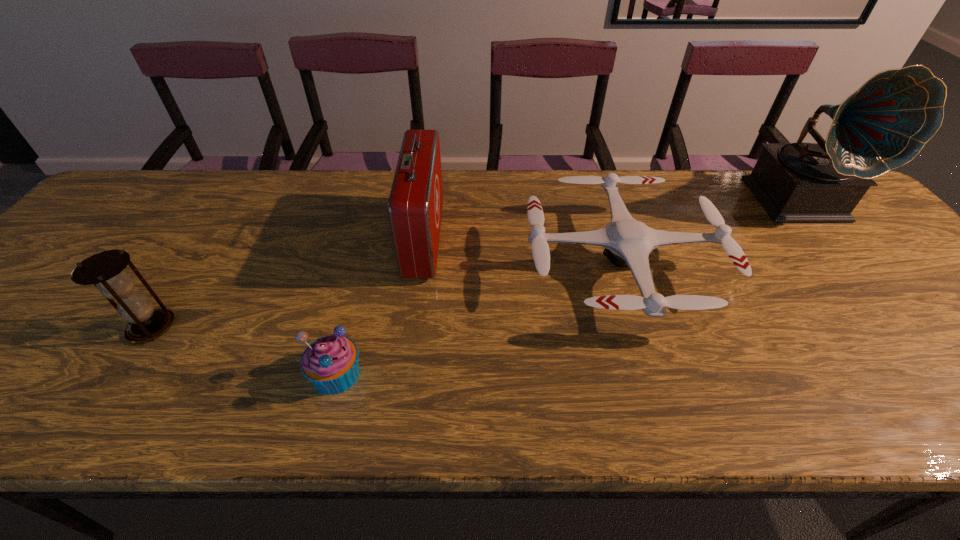
The height and width of the screenshot is (540, 960). I want to click on object that is at the right edge, so click(883, 125).

This screenshot has width=960, height=540. I want to click on object that is at the far right corner, so click(883, 125).

The image size is (960, 540). I want to click on free region at the far edge of the desktop, so pos(299,201).

Locate an element on the screen. vacant space at the near edge of the desktop is located at coordinates (646, 404).

You are a GUI agent. You are given a task and a screenshot of the screen. Output one action in this format:
    pyautogui.click(x=<x>, y=<y>)
    Task: Click on the blank space at the far left corner of the desktop
    The image size is (960, 540).
    Given the screenshot: What is the action you would take?
    pyautogui.click(x=156, y=196)

Where is `blank region between the fourth object from left to right and the third tallest object`? Image resolution: width=960 pixels, height=540 pixels. blank region between the fourth object from left to right and the third tallest object is located at coordinates (386, 296).

Where is `vacant space that's between the record player and the muffin`? This screenshot has height=540, width=960. vacant space that's between the record player and the muffin is located at coordinates (568, 287).

You are a GUI agent. You are given a task and a screenshot of the screen. Output one action in this format:
    pyautogui.click(x=<x>, y=<y>)
    Task: Click on the free spot between the nearest object and the first-aid kit
    Image resolution: width=960 pixels, height=540 pixels.
    Given the screenshot: What is the action you would take?
    pyautogui.click(x=380, y=306)

Where is `vacant point located between the third tallest object and the drone`? vacant point located between the third tallest object and the drone is located at coordinates (386, 296).

The width and height of the screenshot is (960, 540). Identify the location of free space between the hourglass and the rightmost object. (476, 264).